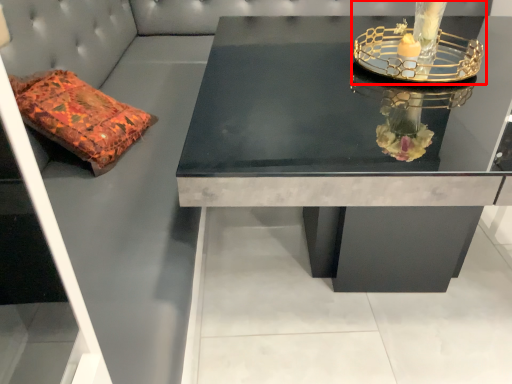
Question: From the image's perspective, what is the correct spatial relationship of candle holder (annotated by the red box) in relation to table?

Choices:
 (A) below
 (B) above

Answer: (B)